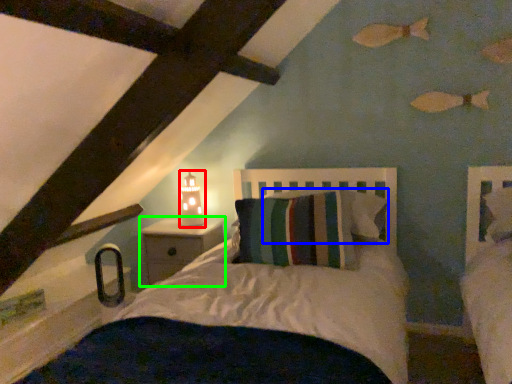
Question: Which object is positioned farthest from table lamp (highlighted by a red box)? Select from pillow (highlighted by a blue box) and nightstand (highlighted by a green box).

Choices:
 (A) pillow
 (B) nightstand

Answer: (A)